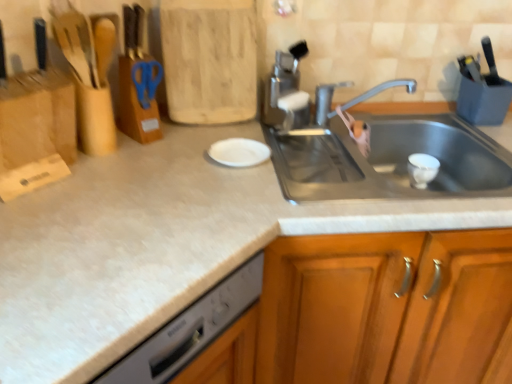
Question: Can you confirm if satin nickel faucet at upper center is positioned to the right of blue plastic scissors at upper center?

Choices:
 (A) yes
 (B) no

Answer: (A)

Question: Is the position of satin nickel faucet at upper center more distant than that of blue plastic scissors at upper center?

Choices:
 (A) no
 (B) yes

Answer: (B)

Question: From the image's perspective, is satin nickel faucet at upper center below blue plastic scissors at upper center?

Choices:
 (A) no
 (B) yes

Answer: (B)

Question: From a real-world perspective, is satin nickel faucet at upper center below blue plastic scissors at upper center?

Choices:
 (A) yes
 (B) no

Answer: (A)

Question: Is satin nickel faucet at upper center far away from blue plastic scissors at upper center?

Choices:
 (A) yes
 (B) no

Answer: (B)

Question: Is satin nickel faucet at upper center located outside blue plastic scissors at upper center?

Choices:
 (A) yes
 (B) no

Answer: (A)

Question: Is silver metallic faucet at upper center further to camera compared to wooden cabinet at center?

Choices:
 (A) no
 (B) yes

Answer: (B)

Question: Can you confirm if silver metallic faucet at upper center is shorter than wooden cabinet at center?

Choices:
 (A) yes
 (B) no

Answer: (A)

Question: Is silver metallic faucet at upper center positioned far away from wooden cabinet at center?

Choices:
 (A) no
 (B) yes

Answer: (A)

Question: From a real-world perspective, does silver metallic faucet at upper center stand above wooden cabinet at center?

Choices:
 (A) yes
 (B) no

Answer: (A)

Question: Is silver metallic faucet at upper center oriented away from wooden cabinet at center?

Choices:
 (A) yes
 (B) no

Answer: (B)

Question: Is silver metallic faucet at upper center smaller than wooden cabinet at center?

Choices:
 (A) yes
 (B) no

Answer: (A)

Question: From the image's perspective, would you say silver metallic faucet at upper center is shown under white matte plate at center?

Choices:
 (A) no
 (B) yes

Answer: (A)